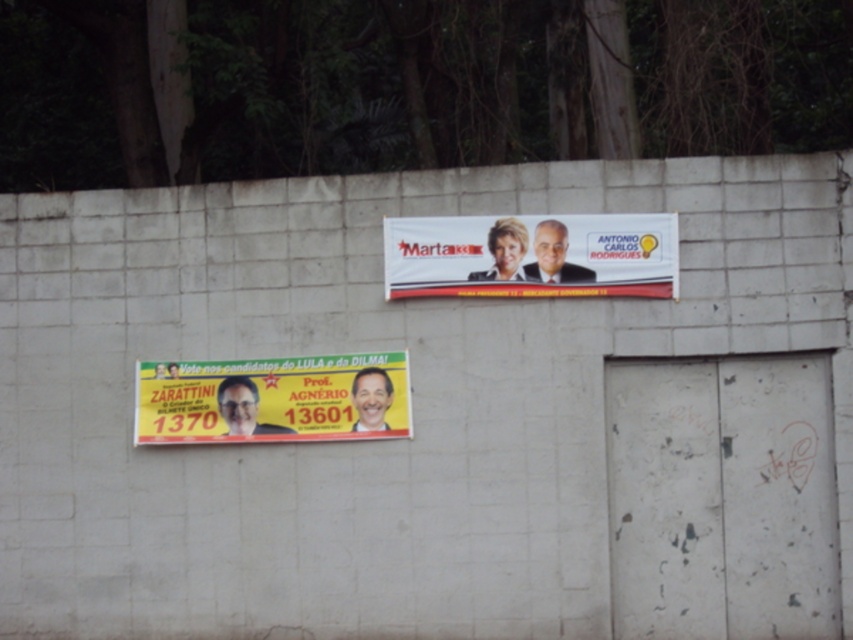
Can you confirm if matte black man at upper center is taller than matte black banner at lower center?

Yes.

Is matte black man at upper center below matte black banner at lower center?

Incorrect, matte black man at upper center is not positioned below matte black banner at lower center.

I want to click on matte black man at upper center, so click(x=554, y=257).

I want to click on matte black man at upper center, so click(x=554, y=257).

Does matte plastic banner at upper center have a smaller size compared to smooth plastic man at upper center?

No, matte plastic banner at upper center is not smaller than smooth plastic man at upper center.

Is matte plastic banner at upper center further to camera compared to smooth plastic man at upper center?

No, it is not.

Does point (675, 280) lie in front of point (515, 227)?

Yes, it is.

Identify the location of matte plastic banner at upper center. (532, 256).

Can you confirm if yellow paper billboard at lower center is wider than smooth plastic man at upper center?

Indeed, yellow paper billboard at lower center has a greater width compared to smooth plastic man at upper center.

Is yellow paper billboard at lower center taller than smooth plastic man at upper center?

Correct, yellow paper billboard at lower center is much taller as smooth plastic man at upper center.

Image resolution: width=853 pixels, height=640 pixels. Find the location of `yellow paper billboard at lower center`. yellow paper billboard at lower center is located at coordinates (273, 397).

Image resolution: width=853 pixels, height=640 pixels. Identify the location of yellow paper billboard at lower center. (273, 397).